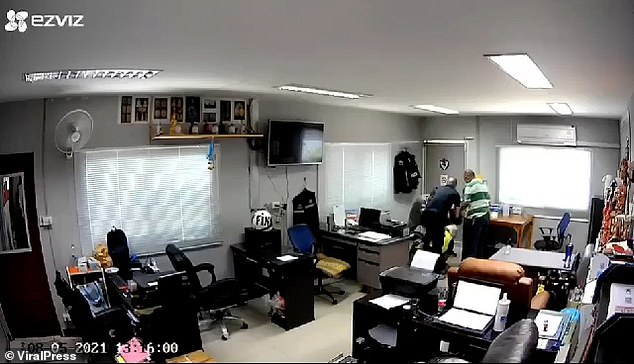
Where is `air conditioning unit`? This screenshot has height=364, width=634. air conditioning unit is located at coordinates (537, 136).